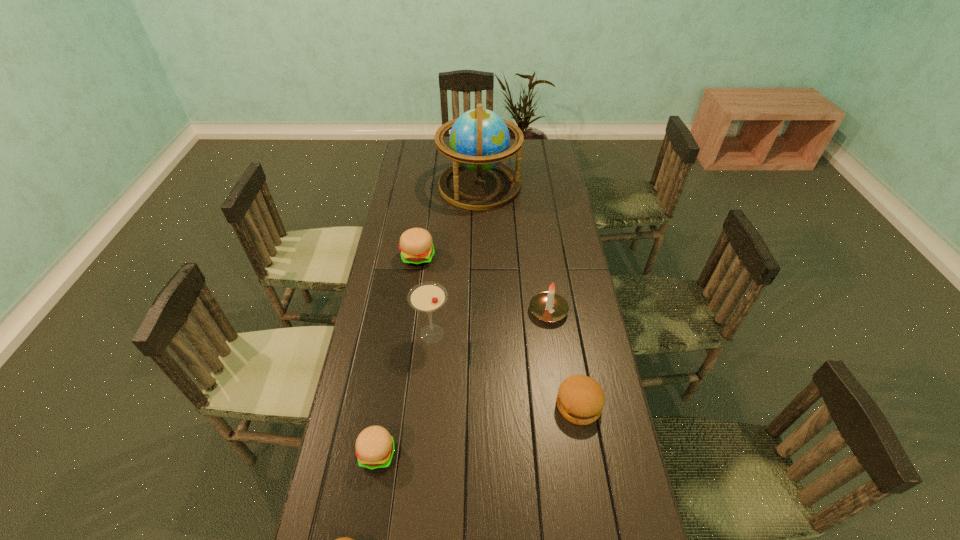
In the image, there is a desktop. At what (x,y) coordinates should I click in order to perform the action: click on free region at the far edge. Please return your answer as a coordinate pair (x, y). Looking at the image, I should click on (448, 161).

Where is `vacant area at the left edge of the desktop`? The width and height of the screenshot is (960, 540). vacant area at the left edge of the desktop is located at coordinates (427, 201).

Identify the location of vacant area at the right edge. The image size is (960, 540). (577, 321).

In the image, there is a desktop. Where is `vacant space at the far left corner`? vacant space at the far left corner is located at coordinates (420, 139).

Find the location of a particular element. blank space at the far right corner of the desktop is located at coordinates (540, 146).

This screenshot has width=960, height=540. I want to click on free spot between the bigger beige hamburger and the tallest object, so click(449, 221).

The width and height of the screenshot is (960, 540). What are the coordinates of `empty space that is in between the tallest hamburger and the smaller beige hamburger` in the screenshot? It's located at (397, 355).

The height and width of the screenshot is (540, 960). Find the location of `vacant area that lies between the fifth farthest object and the second nearest object`. vacant area that lies between the fifth farthest object and the second nearest object is located at coordinates (478, 429).

You are a GUI agent. You are given a task and a screenshot of the screen. Output one action in this format:
    pyautogui.click(x=<x>, y=<y>)
    Task: Click on the free space between the sixth nearest object and the candle
    Image resolution: width=960 pixels, height=540 pixels.
    Given the screenshot: What is the action you would take?
    click(x=483, y=284)

Locate an element on the screen. the sixth closest object to the second nearest object is located at coordinates (479, 139).